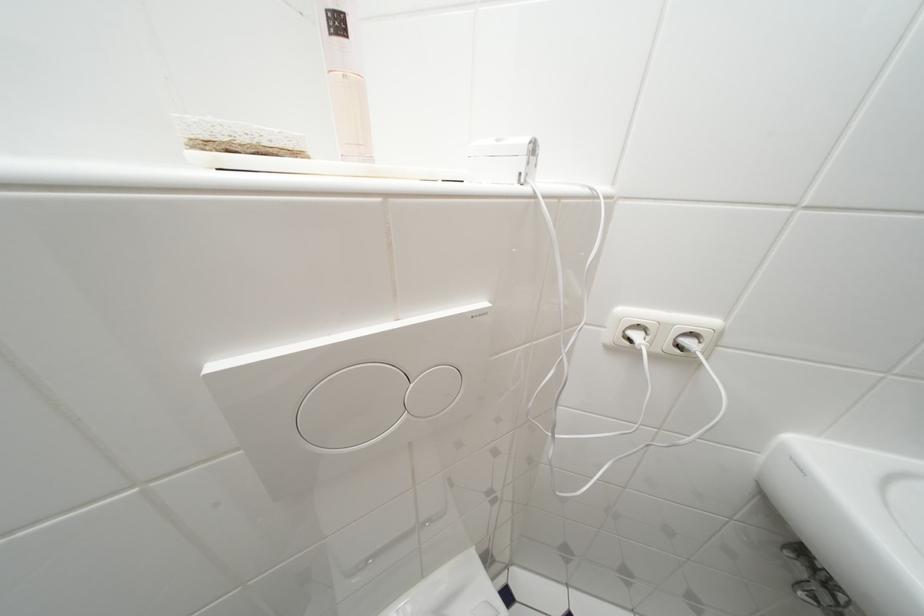
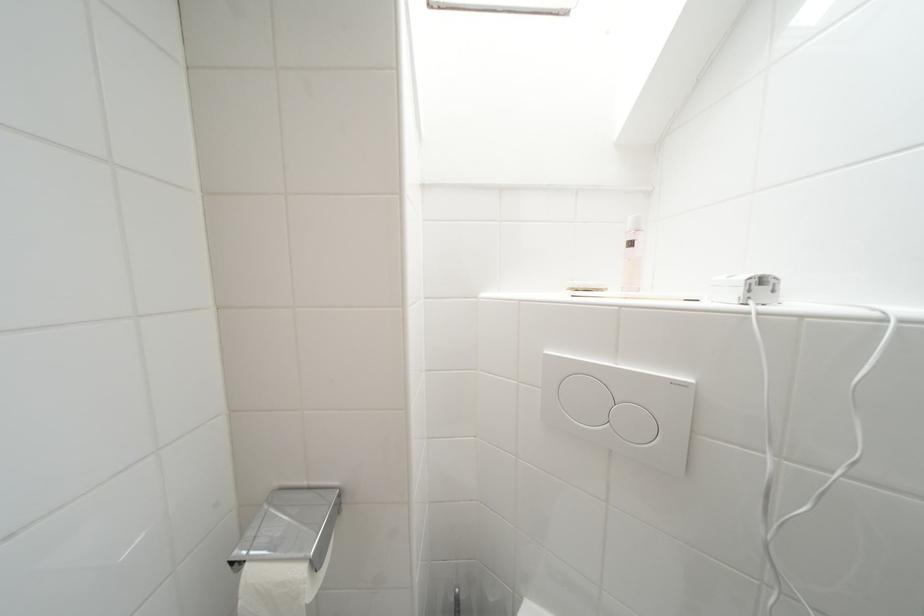
Where in the second image is the point corresponding to (x=345, y=26) from the first image?

(638, 246)